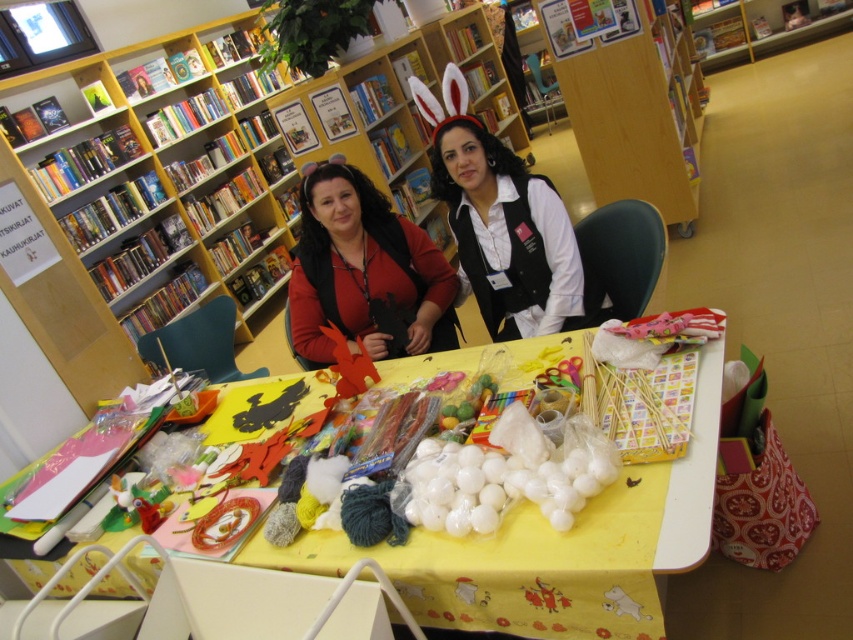
You are organizing a craft fair and need to arrange two volunteers at the table. The volunteers are wearing a black matte vest at center and a matte red sweater at center. According to the scene, which volunteer should you place on the right side to maintain the original setup?

The black matte vest at center should be placed on the right side because it is positioned on the right side of the matte red sweater at center in the original scene.

You are organizing a craft event and need to place a new craft kit on the table. The kit is 30 cm wide. Can you fit it on the yellow paper table at center without overlapping the matte red sweater at center?

The yellow paper table at center is in front of the matte red sweater at center, so there is space available on the table to place the 30 cm wide craft kit without overlapping the sweater.

You are standing in front of the yellow paper table at center and want to reach a craft supply placed on it. If your arm can extend 2.8 feet, can you comfortably reach the items on the table?

The yellow paper table at center is 3.40 feet away from the camera, which is beyond the 2.8 feet reach of your arm. Therefore, you cannot comfortably reach the items on the table.